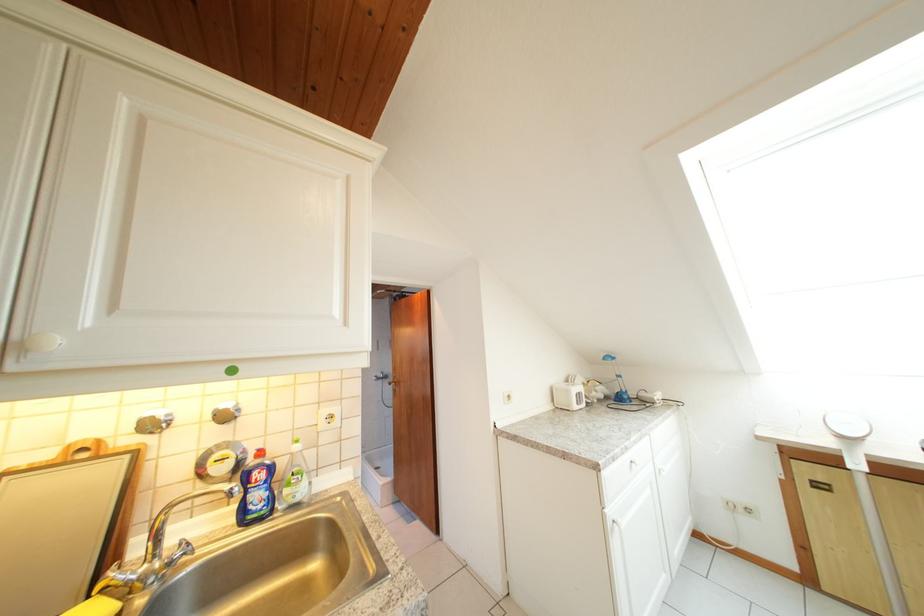
Locate an element on the screen. shower faucet handle is located at coordinates (153, 421).